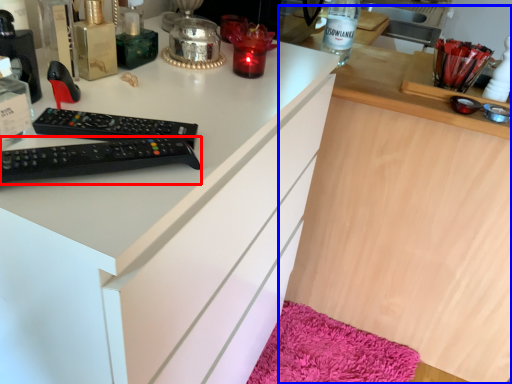
Question: Which object is further to the camera taking this photo, remote control (highlighted by a red box) or computer (highlighted by a blue box)?

Choices:
 (A) remote control
 (B) computer

Answer: (B)